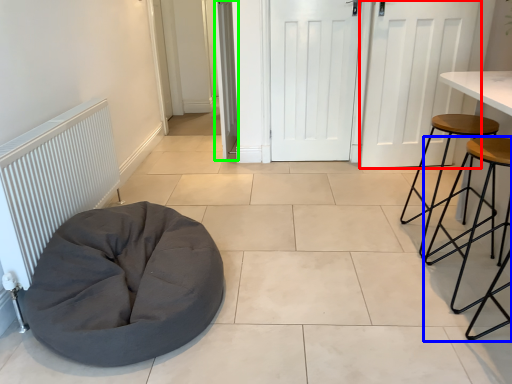
Question: Which is farther away from door (highlighted by a red box)? stool (highlighted by a blue box) or door (highlighted by a green box)?

Choices:
 (A) stool
 (B) door

Answer: (B)